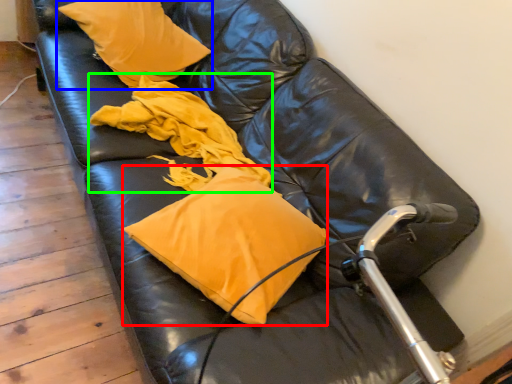
Question: Based on their relative distances, which object is farther from pillow (highlighted by a red box)? Choose from pillow (highlighted by a blue box) and material (highlighted by a green box).

Choices:
 (A) pillow
 (B) material

Answer: (A)